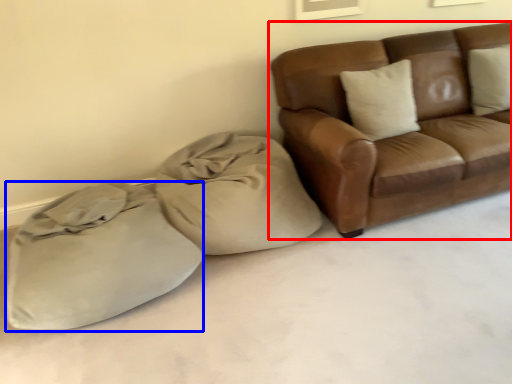
Question: Among these objects, which one is farthest to the camera, studio couch (highlighted by a red box) or sack (highlighted by a blue box)?

Choices:
 (A) studio couch
 (B) sack

Answer: (A)